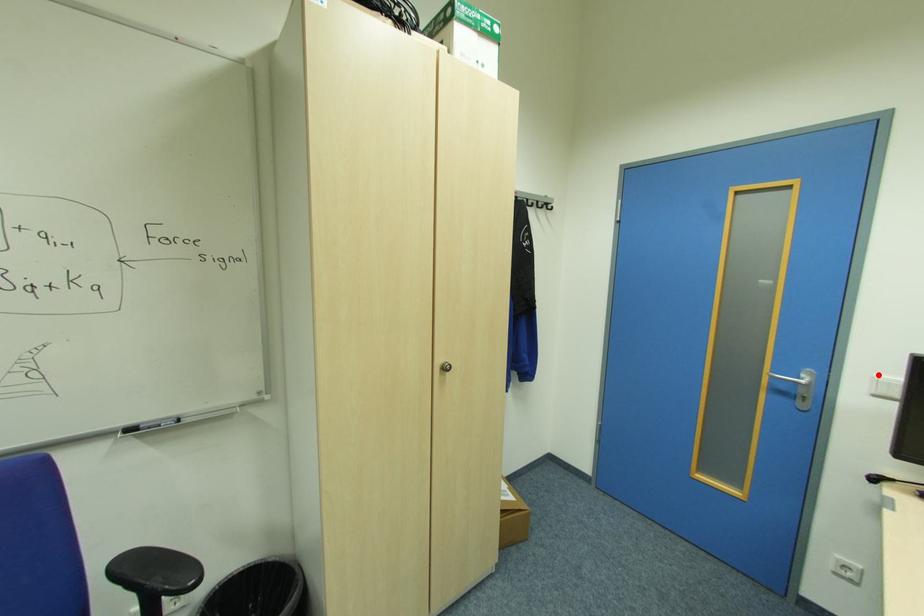
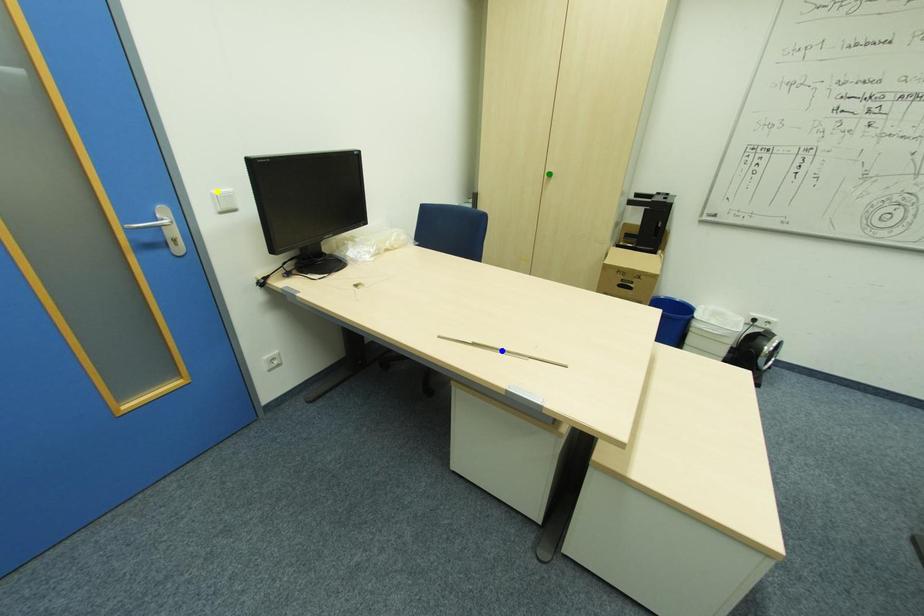
Question: I am providing you with two images of the same scene from different viewpoints. A red point is marked on the first image. You are given multiple points on the second image. Can you choose the point in image 2 that corresponds to the point in image 1?

Choices:
 (A) yellow point
 (B) green point
 (C) blue point

Answer: (A)